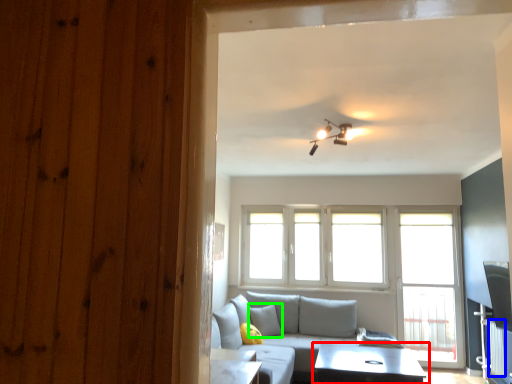
Question: Based on their relative distances, which object is nearer to table (highlighted by a red box)? Choose from curtain (highlighted by a blue box) and pillow (highlighted by a green box).

Choices:
 (A) curtain
 (B) pillow

Answer: (A)